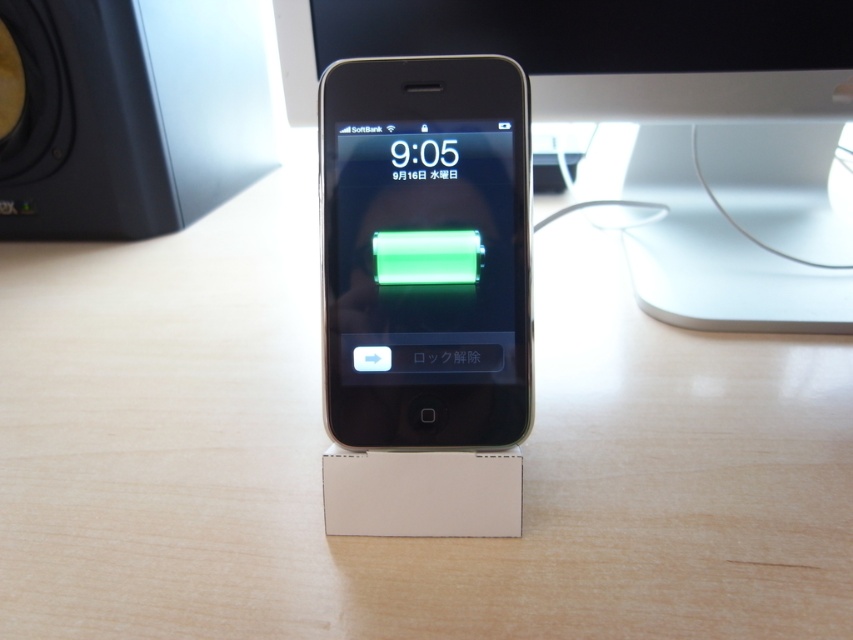
Question: Is black glossy computer monitor at upper center further to camera compared to black matte speaker at upper left?

Choices:
 (A) yes
 (B) no

Answer: (B)

Question: Is satin black ipod at center positioned before black matte speaker at upper left?

Choices:
 (A) yes
 (B) no

Answer: (A)

Question: Which point is closer to the camera?

Choices:
 (A) (479, 115)
 (B) (223, 189)

Answer: (A)

Question: Does satin black ipod at center come behind black matte speaker at upper left?

Choices:
 (A) yes
 (B) no

Answer: (B)

Question: Estimate the real-world distances between objects in this image. Which object is farther from the black matte speaker at upper left?

Choices:
 (A) black glossy computer monitor at upper center
 (B) satin black ipod at center

Answer: (B)

Question: Which point appears farthest from the camera in this image?

Choices:
 (A) (62, 188)
 (B) (734, 257)

Answer: (A)